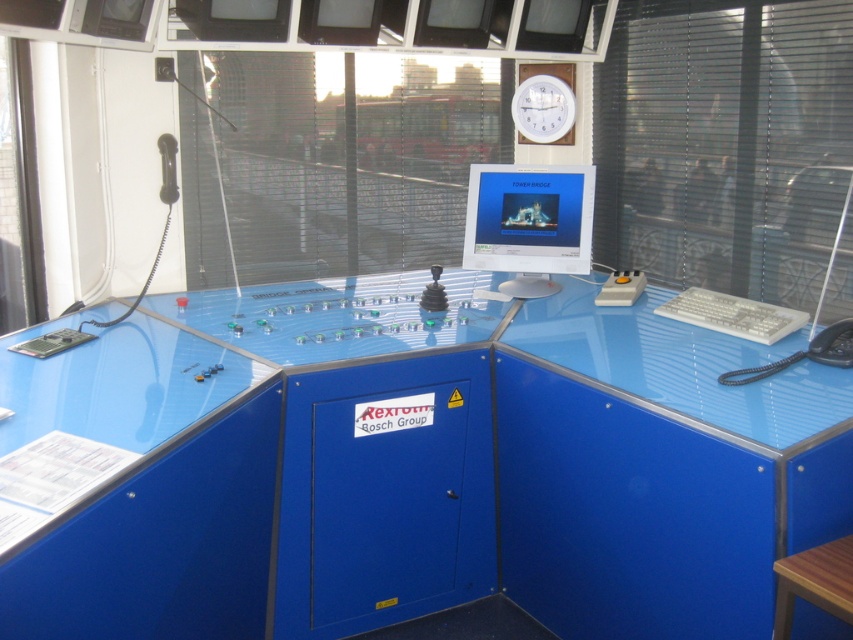
You are a technician in the control room needing to access both the glossy plastic computer desk at center and the wooden stool at lower right. Which object should you approach first to reach the other one?

You should first approach the wooden stool at lower right because the glossy plastic computer desk at center is located above it, meaning the stool is closer to you and you can then reach the desk from there.

You are an operator in the control room. You need to reach both the glossy plastic computer desk at center and the white plastic clock at upper center. Which object is closer to your current position if you are standing directly in front of the control panel?

The glossy plastic computer desk at center is closer to your current position because it is to the left of the white plastic clock at upper center, implying it is positioned lower and nearer in the room layout.